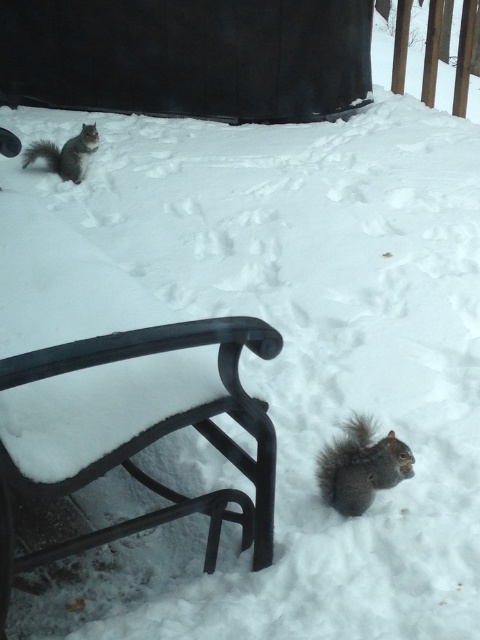
Question: Which of the following is the farthest from the observer?

Choices:
 (A) gray furry squirrel at upper left
 (B) gray furry squirrel at lower right

Answer: (A)

Question: Can you confirm if gray furry squirrel at lower right is positioned to the left of gray furry squirrel at upper left?

Choices:
 (A) no
 (B) yes

Answer: (A)

Question: Which point is farther from the camera taking this photo?

Choices:
 (A) (151, 337)
 (B) (37, 150)
 (C) (338, 474)

Answer: (B)

Question: Considering the real-world distances, which object is farthest from the gray furry squirrel at upper left?

Choices:
 (A) black metal bench at lower left
 (B) gray furry squirrel at lower right

Answer: (B)

Question: Is black metal bench at lower left wider than gray furry squirrel at lower right?

Choices:
 (A) yes
 (B) no

Answer: (A)

Question: Does black metal bench at lower left have a smaller size compared to gray furry squirrel at lower right?

Choices:
 (A) yes
 (B) no

Answer: (B)